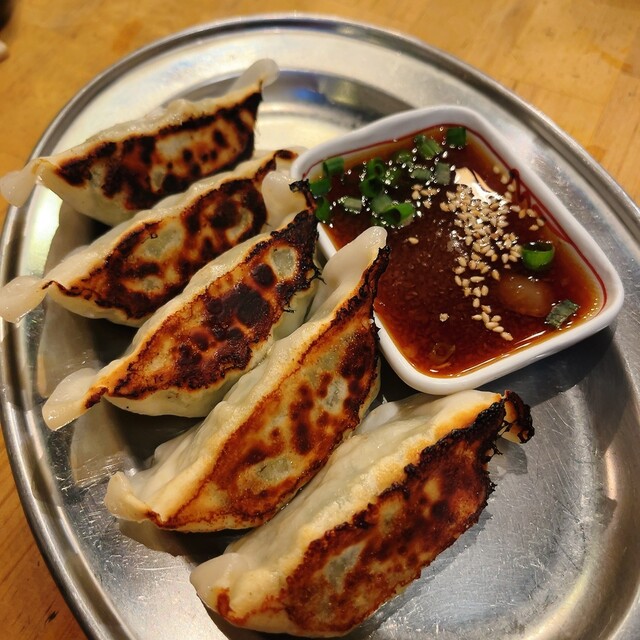
Find the location of a particular element. grain lines in wood table is located at coordinates (528, 22), (628, 146), (605, 61), (489, 28).